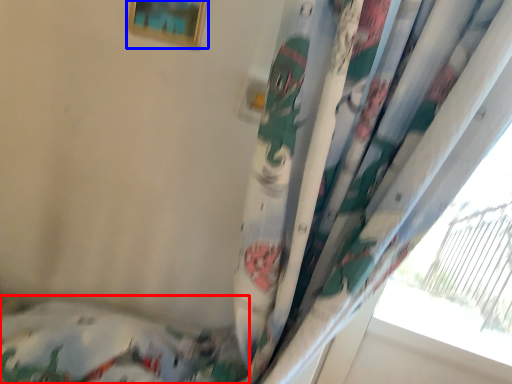
Question: Among these objects, which one is nearest to the camera, bed (highlighted by a red box) or picture frame (highlighted by a blue box)?

Choices:
 (A) bed
 (B) picture frame

Answer: (B)